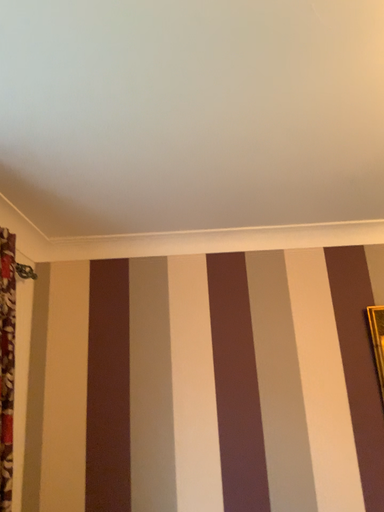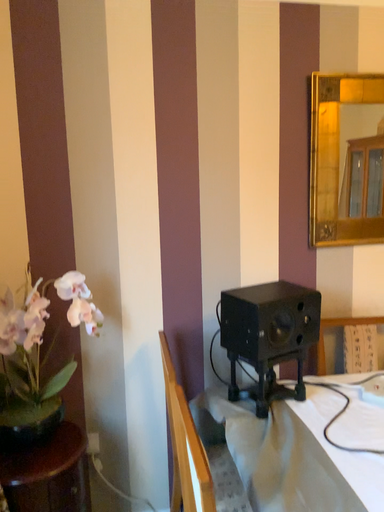
Question: Which way did the camera rotate in the video?

Choices:
 (A) rotated downward
 (B) rotated upward

Answer: (A)